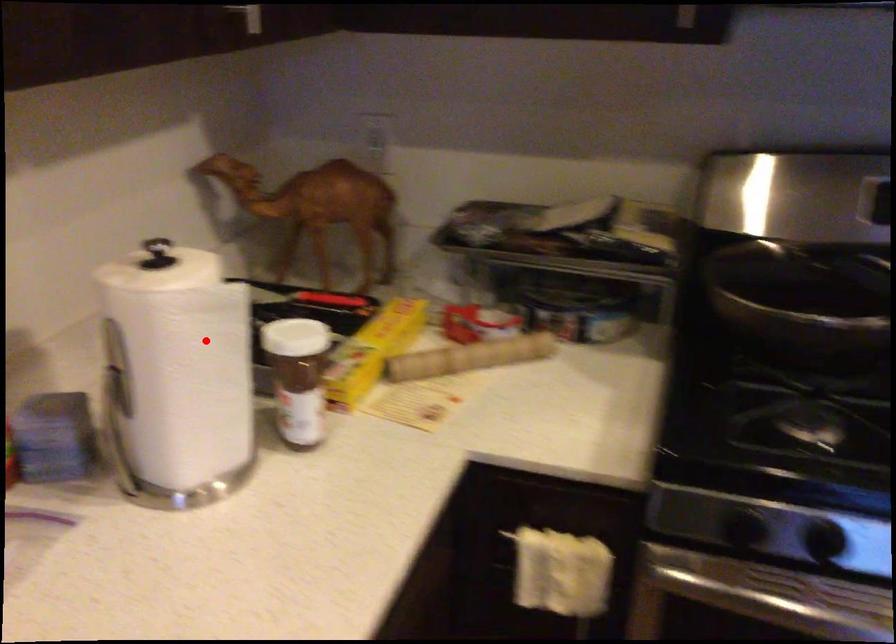
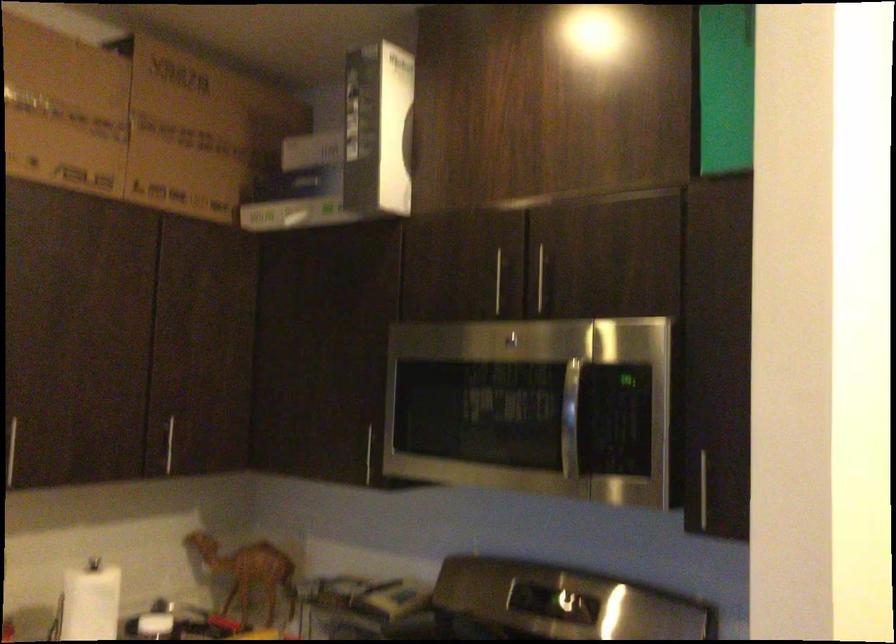
In the second image, find the point that corresponds to the highlighted location in the first image.

(90, 601)